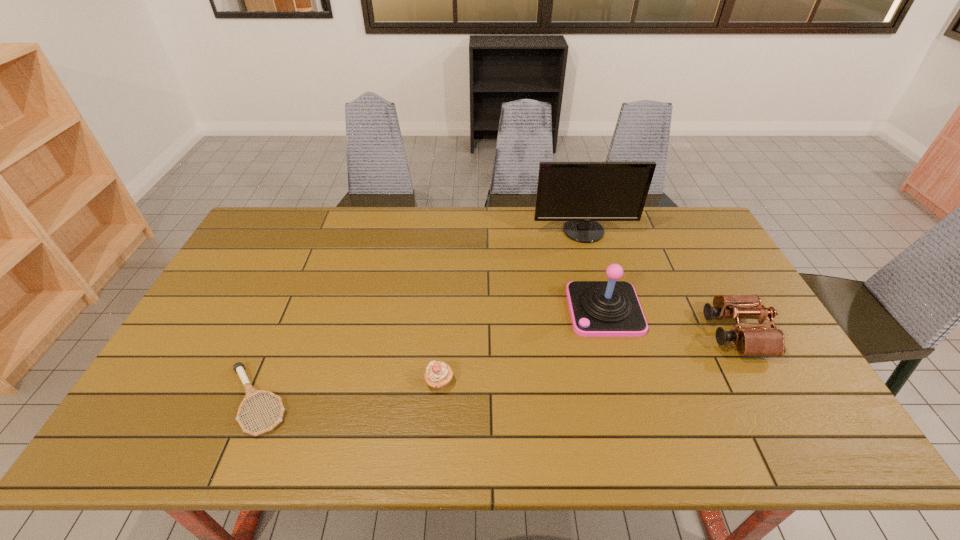
You are a GUI agent. You are given a task and a screenshot of the screen. Output one action in this format:
    pyautogui.click(x=<x>, y=<y>)
    Task: Click on the tallest object
    The height and width of the screenshot is (540, 960).
    Given the screenshot: What is the action you would take?
    pyautogui.click(x=581, y=193)

The image size is (960, 540). I want to click on the farthest object, so click(581, 193).

Find the location of a particular element. joystick is located at coordinates (611, 308).

Identify the location of binoculars. Image resolution: width=960 pixels, height=540 pixels. pyautogui.click(x=756, y=340).

This screenshot has width=960, height=540. I want to click on the third tallest object, so click(756, 340).

I want to click on cupcake, so click(438, 374).

This screenshot has height=540, width=960. What are the coordinates of `the fourth tallest object` in the screenshot? It's located at (438, 374).

Find the location of a particular element. This screenshot has height=540, width=960. tennis racket is located at coordinates (250, 391).

At what (x,y) coordinates should I click in order to perform the action: click on the leftmost object. Please return your answer as a coordinate pair (x, y). The width and height of the screenshot is (960, 540). Looking at the image, I should click on (250, 391).

Image resolution: width=960 pixels, height=540 pixels. Identify the location of free point located on the screen side of the tallest object. (594, 269).